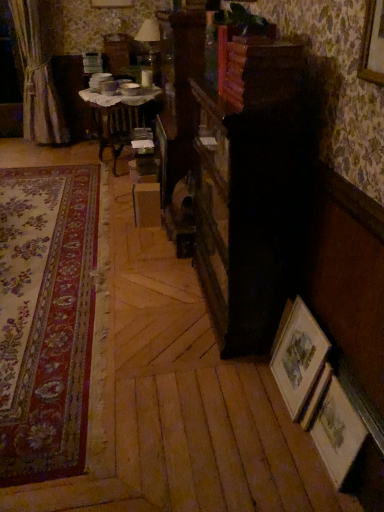
The image size is (384, 512). I want to click on vacant region to the left of wooden framed print at lower right, which appears as the 1th picture frame when viewed from the left, so click(x=250, y=392).